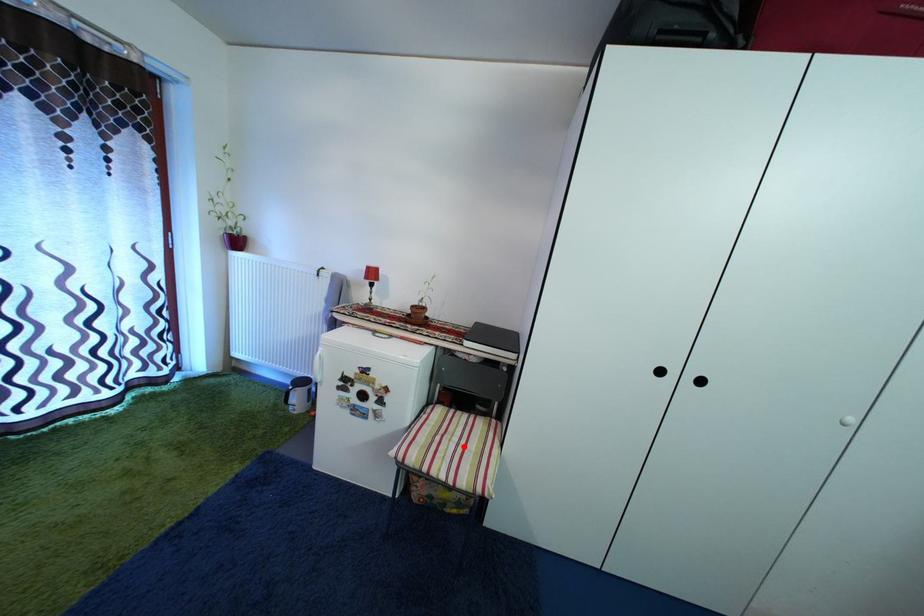
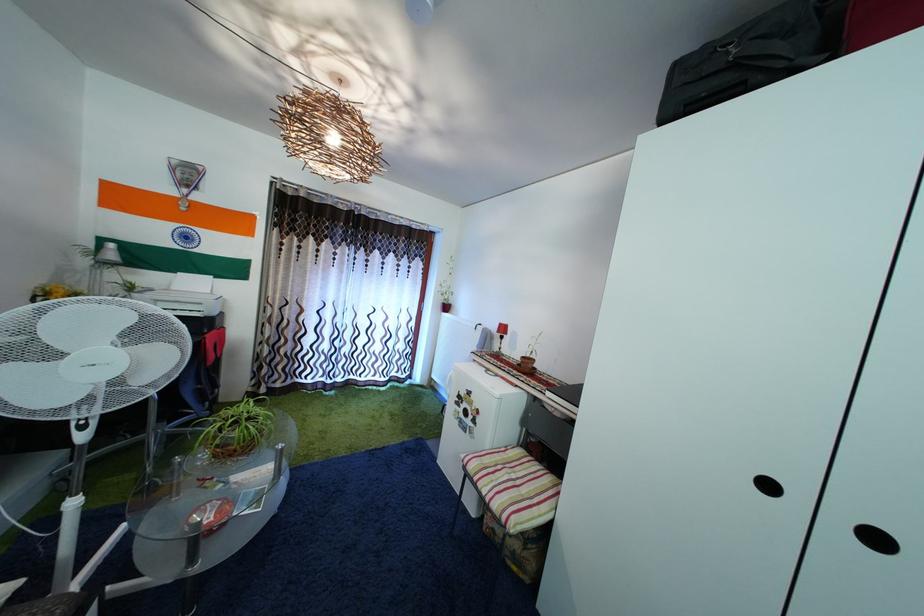
Where in the second image is the point corresponding to the highlighted location from the first image?

(521, 484)